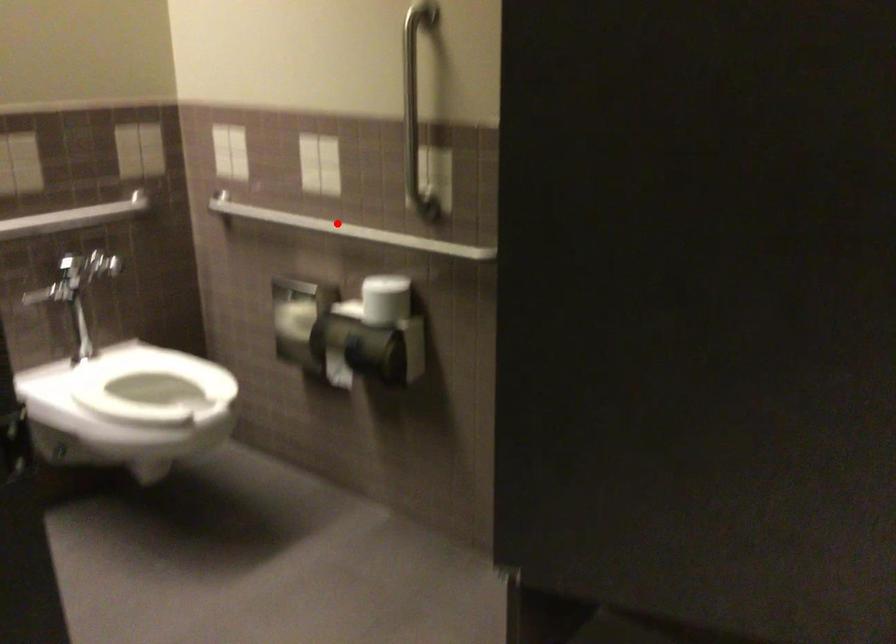
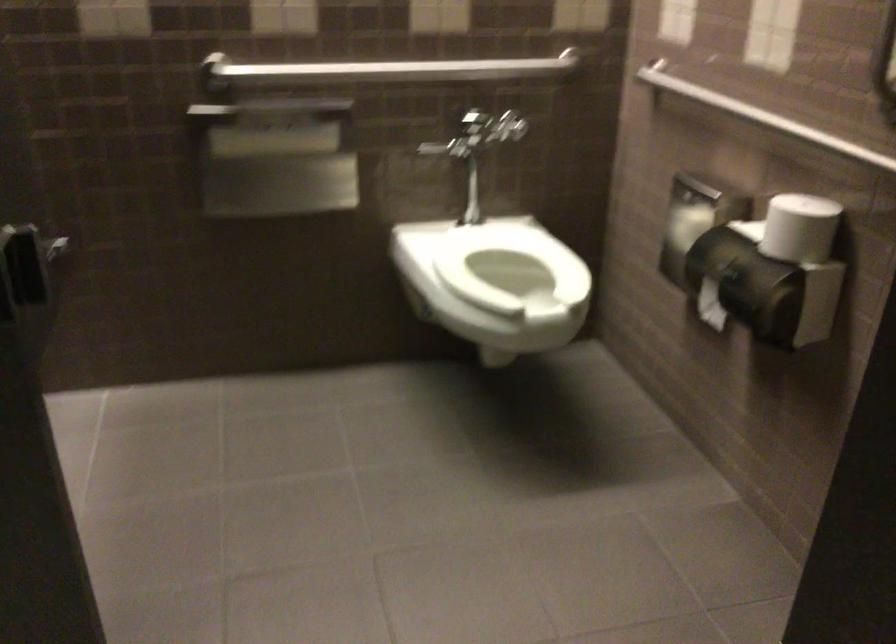
Question: I am providing you with two images of the same scene from different viewpoints. Given a red point in image1, look at the same physical point in image2. Is it:

Choices:
 (A) Closer to the viewpoint
 (B) Farther from the viewpoint

Answer: (A)